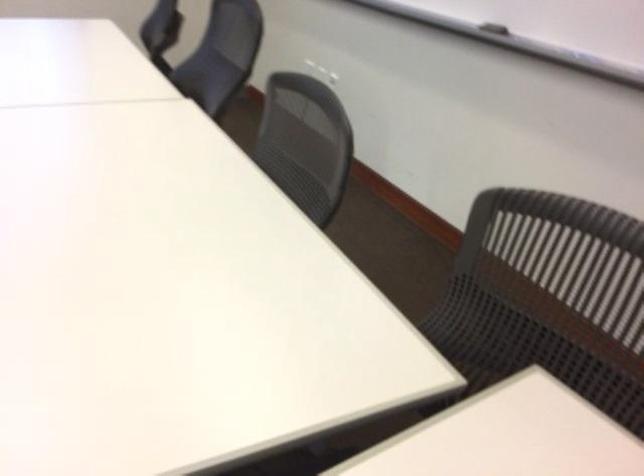
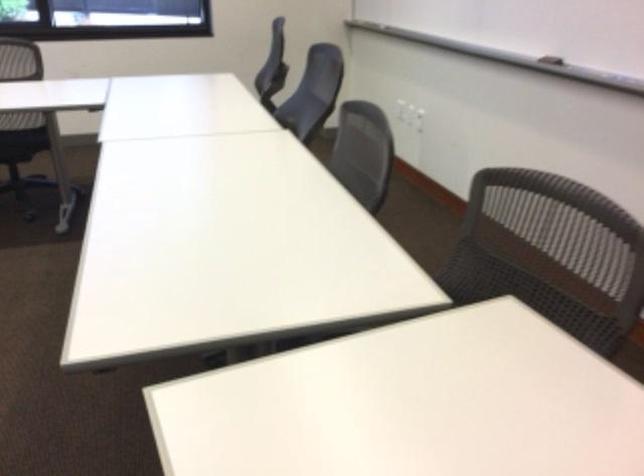
Question: The camera is either moving clockwise (left) or counter-clockwise (right) around the object. The first image is from the beginning of the video and the second image is from the end. Is the camera moving left or right when shooting the video?

Choices:
 (A) Left
 (B) Right

Answer: (B)